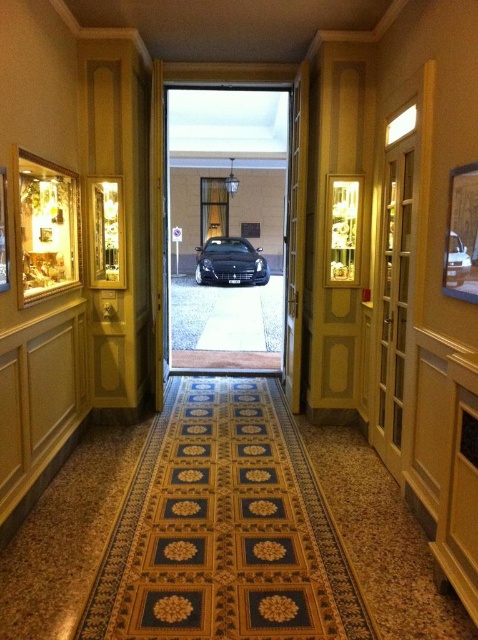
Can you confirm if wooden door at right is positioned to the right of shiny black car at center?

Indeed, wooden door at right is positioned on the right side of shiny black car at center.

Based on the photo, is wooden door at right positioned behind shiny black car at center?

No, it is not.

This screenshot has height=640, width=478. Find the location of `wooden door at right`. wooden door at right is located at coordinates (393, 288).